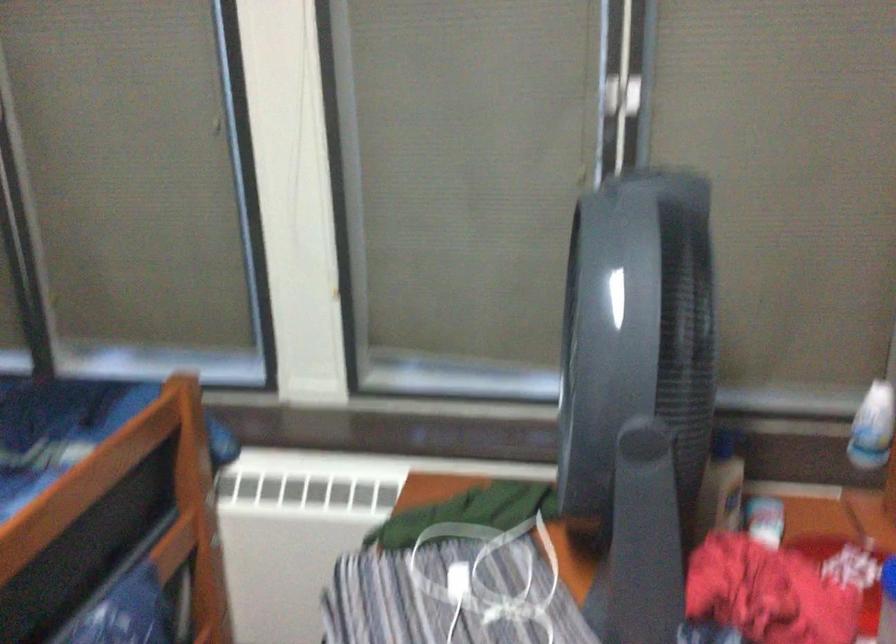
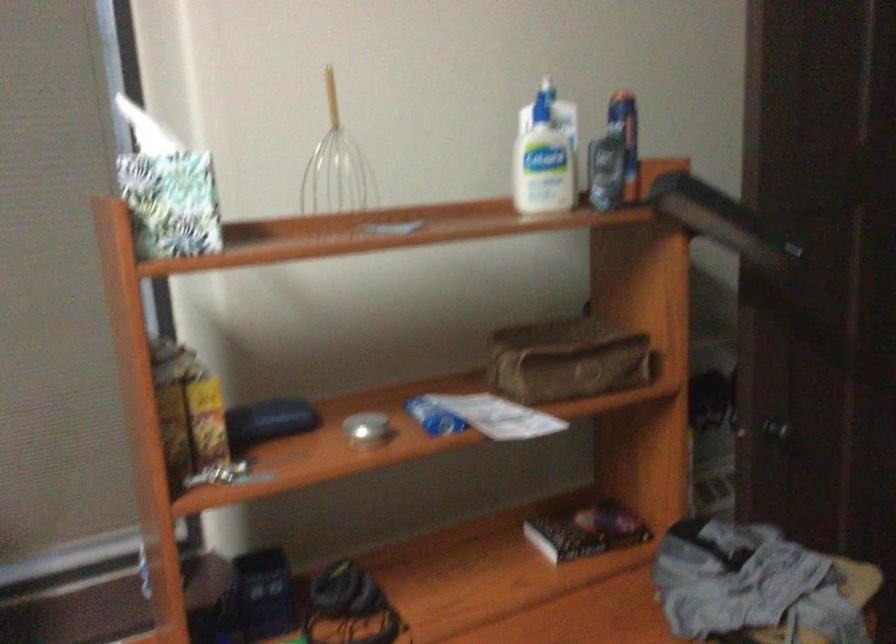
Question: Based on the continuous images, in which direction is the camera rotating? Reply with the corresponding letter.

Choices:
 (A) Left
 (B) Right
 (C) Up
 (D) Down

Answer: (B)